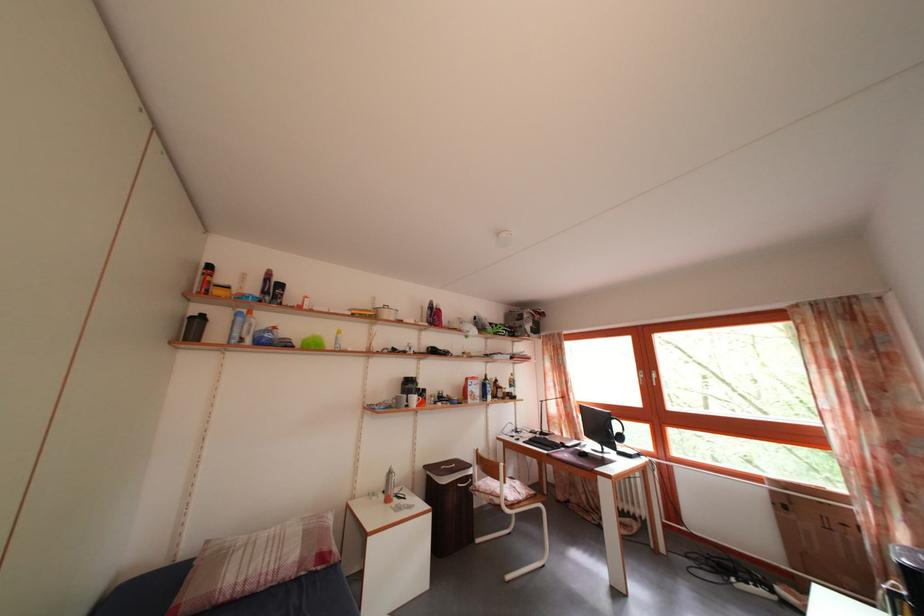
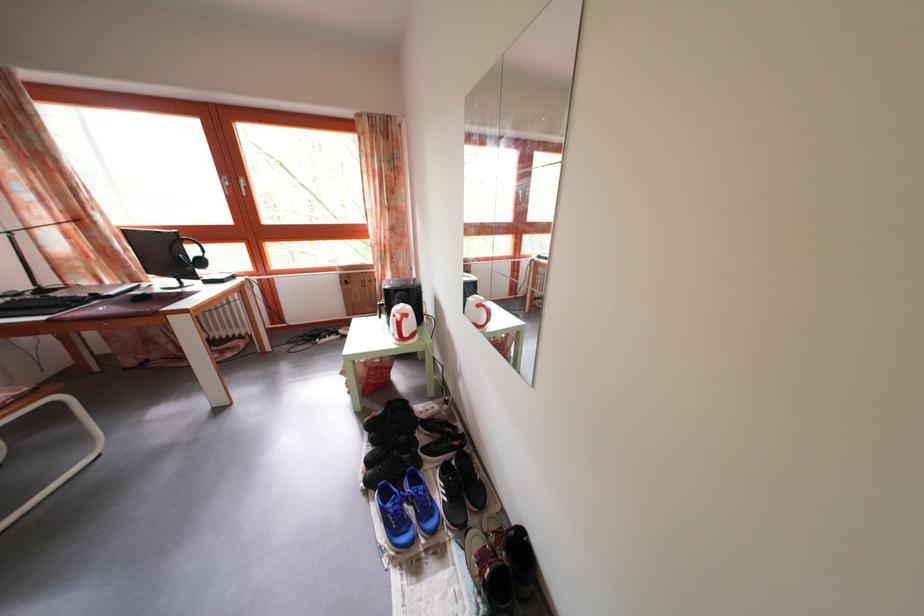
Based on the continuous images, in which direction is the camera rotating?

The camera rotated toward right-down.